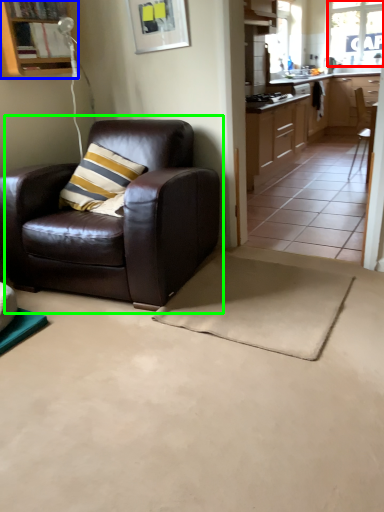
Question: Based on their relative distances, which object is nearer to window (highlighted by a red box)? Choose from cabinetry (highlighted by a blue box) and chair (highlighted by a green box).

Choices:
 (A) cabinetry
 (B) chair

Answer: (A)